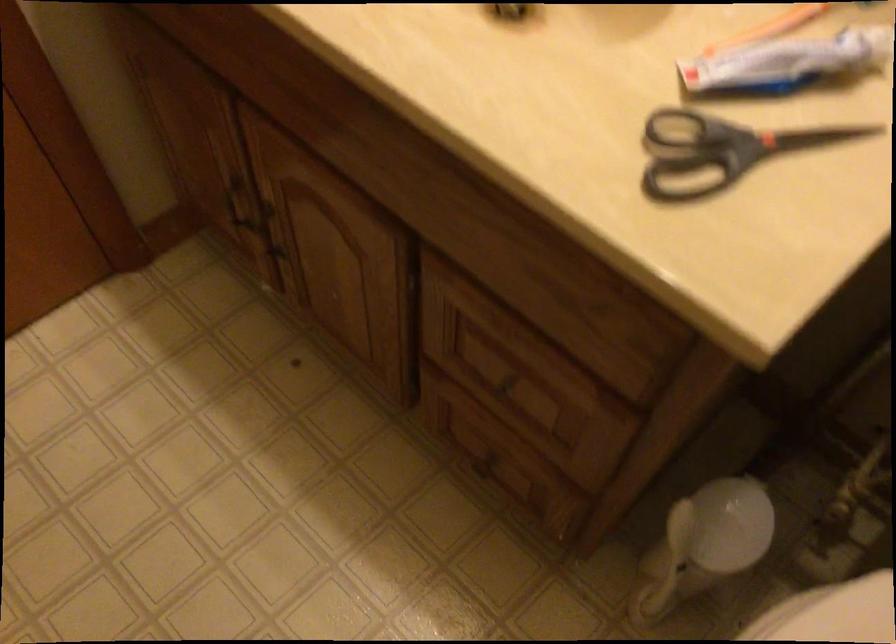
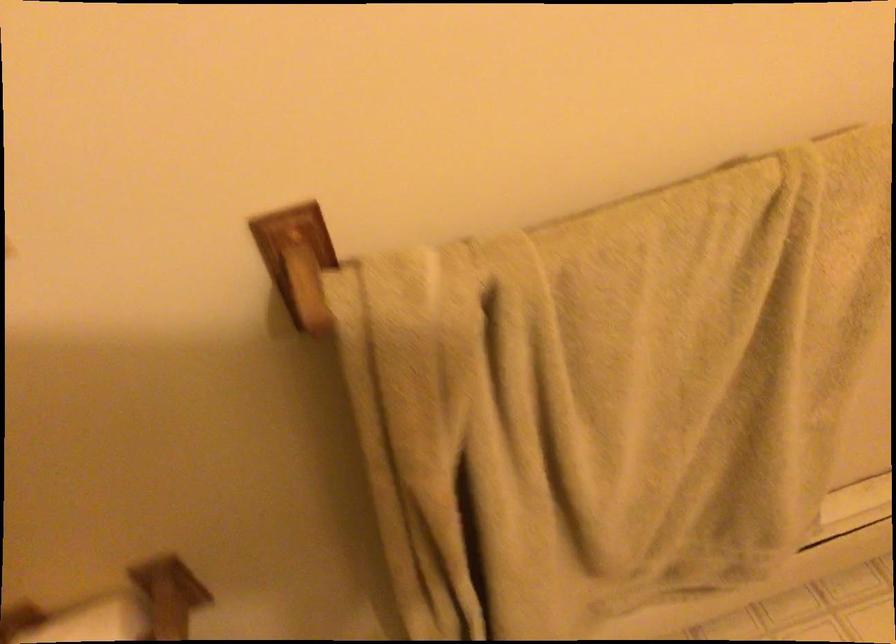
The first image is from the beginning of the video and the second image is from the end. How did the camera likely rotate when shooting the video?

The camera's rotation is toward left-down.